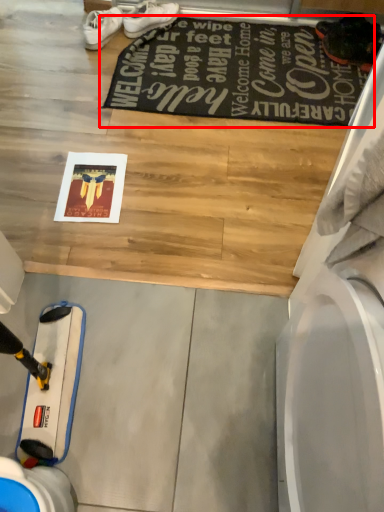
Question: Where is mat (annotated by the red box) located in relation to footwear in the image?

Choices:
 (A) right
 (B) left

Answer: (A)